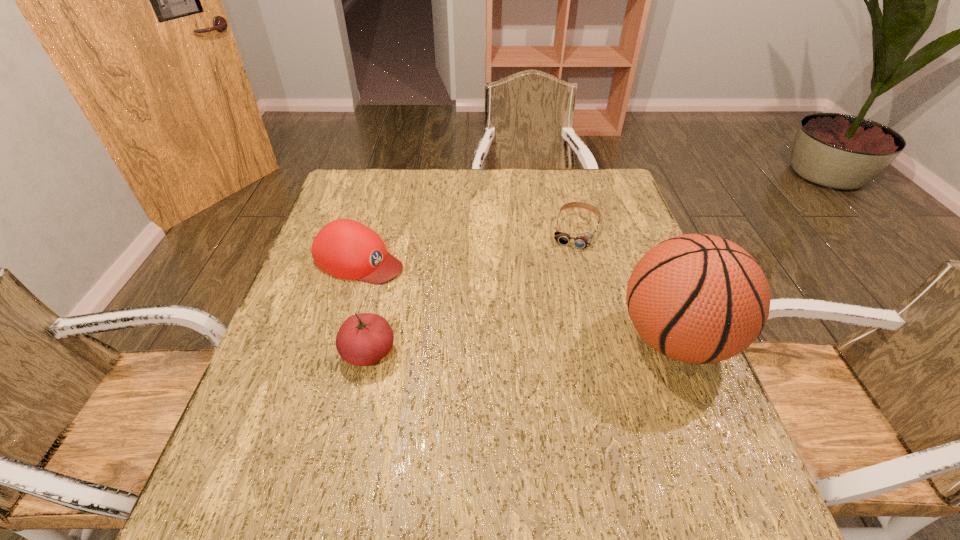
This screenshot has height=540, width=960. In order to click on free space on the desktop that is between the tomato and the basketball and is positioned on the front-facing side of the baseball cap in this screenshot , I will do `click(560, 344)`.

The height and width of the screenshot is (540, 960). What are the coordinates of `free space on the desktop that is between the tomato and the basketball and is positioned on the front-facing side of the shortest object` in the screenshot? It's located at (539, 345).